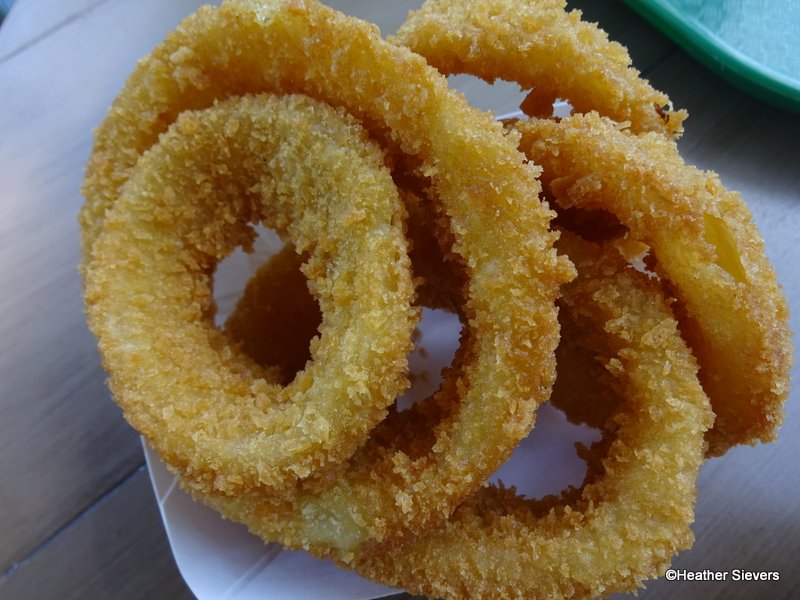
Image resolution: width=800 pixels, height=600 pixels. Identify the location of wooden table to left of snack. (33, 161).